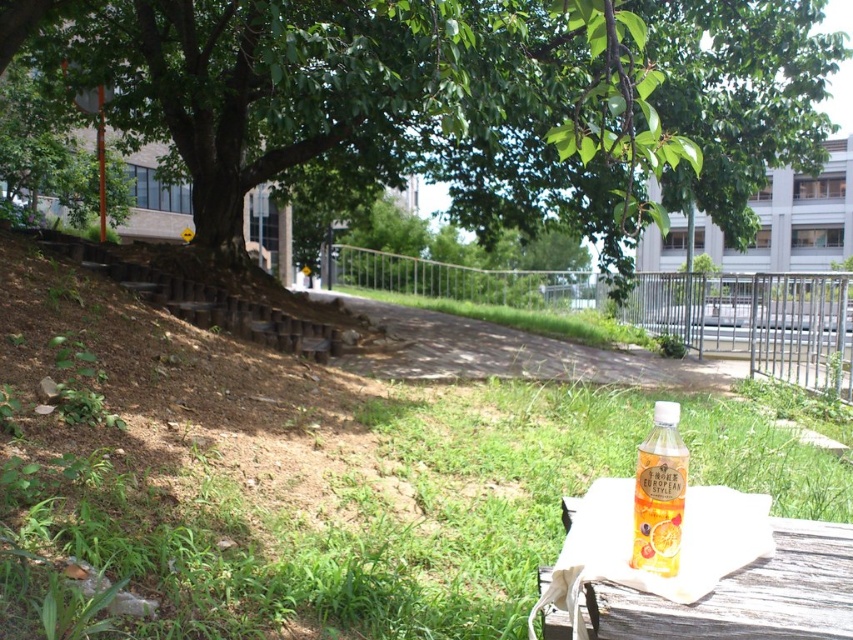
Question: Which object is the closest to the green grass at lower left?

Choices:
 (A) translucent plastic bottle at lower right
 (B) green leafy tree at upper center
 (C) wooden table at lower right

Answer: (C)

Question: Which point is farther to the camera?

Choices:
 (A) (833, 547)
 (B) (804, 156)

Answer: (B)

Question: Does green grass at lower left lie behind green leafy tree at upper center?

Choices:
 (A) yes
 (B) no

Answer: (A)

Question: Can you confirm if green grass at lower left is positioned to the right of translucent plastic bottle at lower right?

Choices:
 (A) yes
 (B) no

Answer: (A)

Question: In this image, where is green leafy tree at upper center located relative to translucent plastic bottle at lower right?

Choices:
 (A) above
 (B) below

Answer: (A)

Question: Which point is closer to the camera?

Choices:
 (A) (837, 556)
 (B) (132, 538)
 (C) (659, 428)
 (D) (714, 104)

Answer: (C)